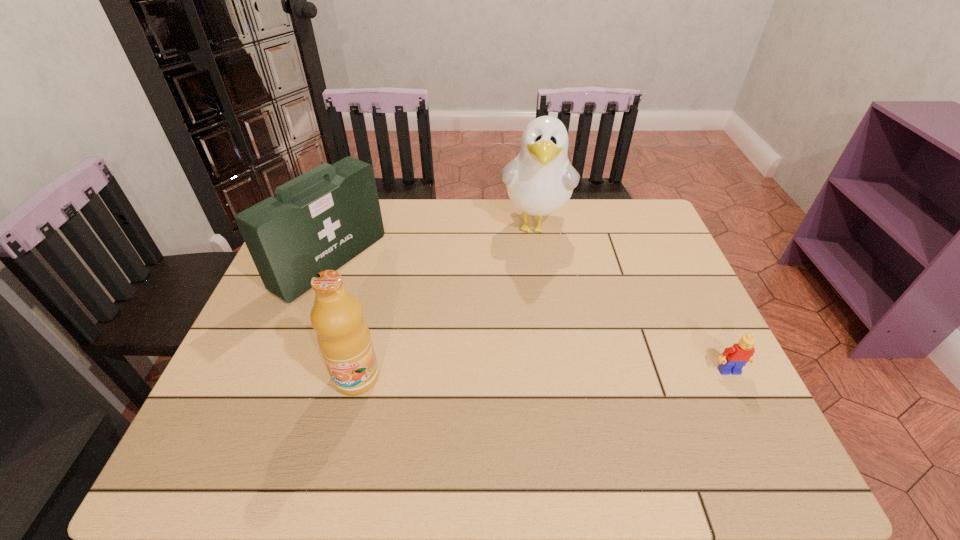
At what (x,y) coordinates should I click in order to perform the action: click on vacant space at the near edge of the desktop. Please return your answer as a coordinate pair (x, y). The image size is (960, 540). Looking at the image, I should click on (469, 395).

This screenshot has width=960, height=540. I want to click on blank space at the left edge of the desktop, so click(x=275, y=307).

This screenshot has width=960, height=540. Identify the location of free space at the far right corner. (660, 241).

Where is `vacant position at the near right corner of the desktop`? The width and height of the screenshot is (960, 540). vacant position at the near right corner of the desktop is located at coordinates (729, 397).

Image resolution: width=960 pixels, height=540 pixels. I want to click on unoccupied position between the first-aid kit and the gull, so click(x=433, y=244).

Find the location of a particular element. This screenshot has width=960, height=540. vacant point located between the Lego and the fruit juice is located at coordinates (543, 374).

Where is `free space between the first-aid kit and the gull`? Image resolution: width=960 pixels, height=540 pixels. free space between the first-aid kit and the gull is located at coordinates (433, 244).

At what (x,y) coordinates should I click in order to perform the action: click on blank region between the first-aid kit and the Lego. Please return your answer as a coordinate pair (x, y). Looking at the image, I should click on (530, 316).

Where is `blank region between the first-aid kit and the rightmost object`? The height and width of the screenshot is (540, 960). blank region between the first-aid kit and the rightmost object is located at coordinates (530, 316).

This screenshot has width=960, height=540. In order to click on free space between the second object from right to left and the fruit juice in this screenshot , I will do `click(445, 302)`.